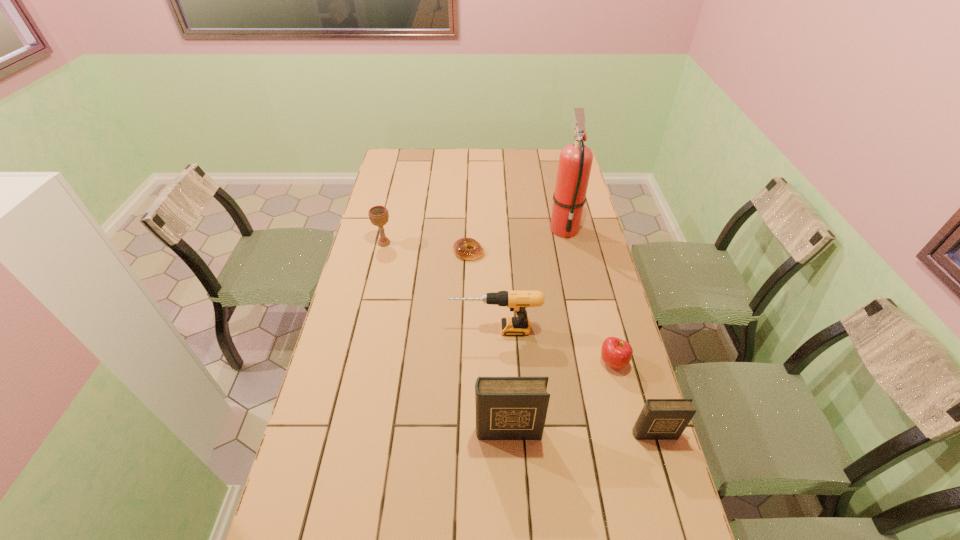
Find the location of `the left diary`. the left diary is located at coordinates (507, 408).

Image resolution: width=960 pixels, height=540 pixels. Identify the location of the sixth shortest object. click(507, 408).

Locate an element on the screen. Image resolution: width=960 pixels, height=540 pixels. the shorter diary is located at coordinates (660, 419).

Identify the location of bagel. (460, 246).

Locate an element on the screen. the tallest object is located at coordinates (575, 161).

Where is `chalice`? chalice is located at coordinates (378, 215).

Where is `apple`? The image size is (960, 540). apple is located at coordinates (616, 353).

The image size is (960, 540). I want to click on the second shortest object, so click(x=616, y=353).

At what (x,y) coordinates should I click in order to perform the action: click on the fourth nearest object. Please return your answer as a coordinate pair (x, y). Looking at the image, I should click on (517, 301).

Where is `blank space located on the front cover of the taller diary`? The width and height of the screenshot is (960, 540). blank space located on the front cover of the taller diary is located at coordinates (510, 467).